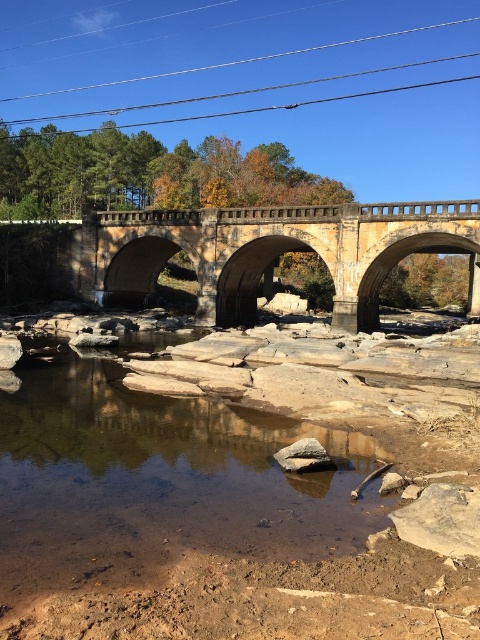
Question: Can you confirm if metallic wire at upper center is thinner than gray rough rock at center?

Choices:
 (A) yes
 (B) no

Answer: (B)

Question: Estimate the real-world distances between objects in this image. Which object is farther from the gray rough rock at center?

Choices:
 (A) stone bridge at center
 (B) metallic wire at upper center

Answer: (B)

Question: Which object appears farthest from the camera in this image?

Choices:
 (A) metallic wire at upper center
 (B) gray rough rock at center

Answer: (A)

Question: Estimate the real-world distances between objects in this image. Which object is closer to the gray rough rock at center?

Choices:
 (A) metallic wire at upper center
 (B) stone bridge at center

Answer: (B)

Question: Can you confirm if stone bridge at center is positioned to the left of gray rough rock at center?

Choices:
 (A) no
 (B) yes

Answer: (A)

Question: Observing the image, what is the correct spatial positioning of metallic wire at upper center in reference to gray rough rock at center?

Choices:
 (A) right
 (B) left

Answer: (B)